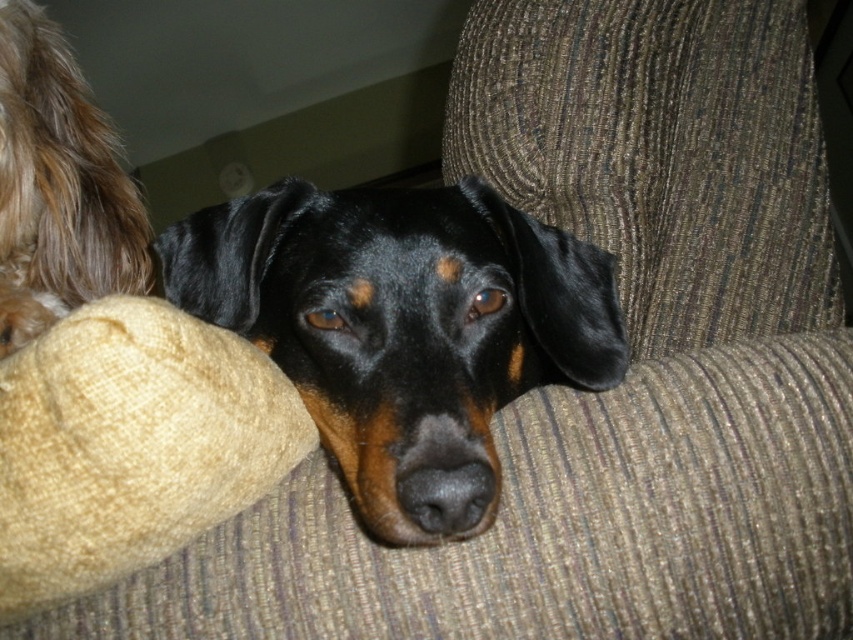
You are a dog trainer observing the scene. You need to place a treat between the black shiny dog at center and the fuzzy brown fur at upper left. Can you fit the treat in the space between them if the treat is 30 centimeters long?

The distance between the black shiny dog at center and the fuzzy brown fur at upper left is 33.50 centimeters. Since the treat is 30 centimeters long, it can fit in the space between them as the distance is greater than the treat length.

You are a photographer trying to capture the black shiny dog at center and the fuzzy brown fur at upper left in the same frame. Based on their heights, which one would you need to adjust your camera angle to focus on first?

The black shiny dog at center has a lesser height compared to fuzzy brown fur at upper left, so you would need to lower your camera angle to focus on the black shiny dog at center first before adjusting to capture the taller fuzzy brown fur at upper left.